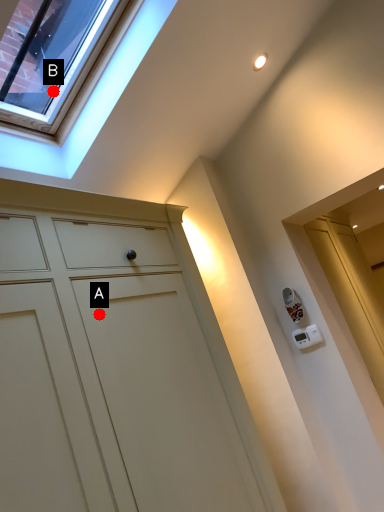
Question: Two points are circled on the image, labeled by A and B beside each circle. Which point appears farthest from the camera in this image?

Choices:
 (A) A is further
 (B) B is further

Answer: (B)